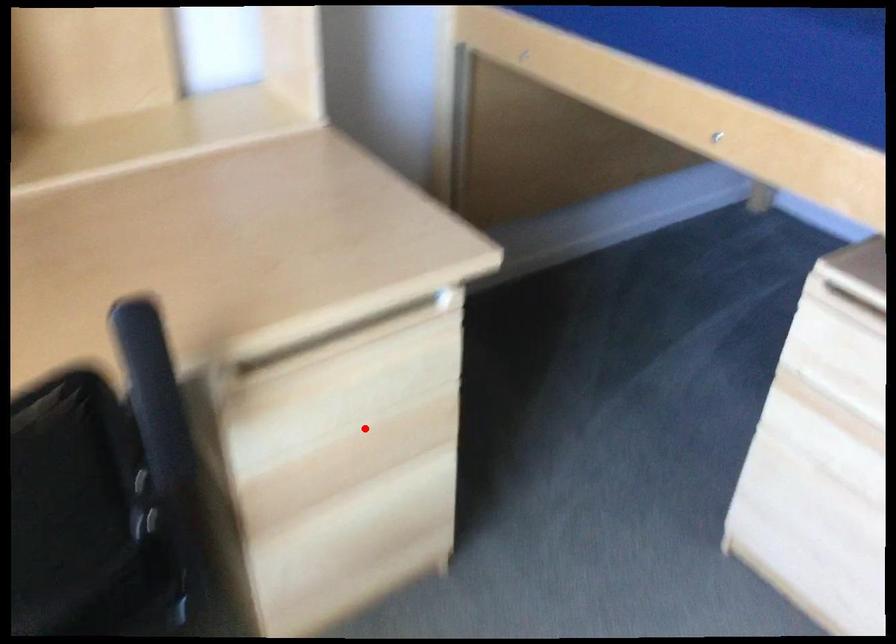
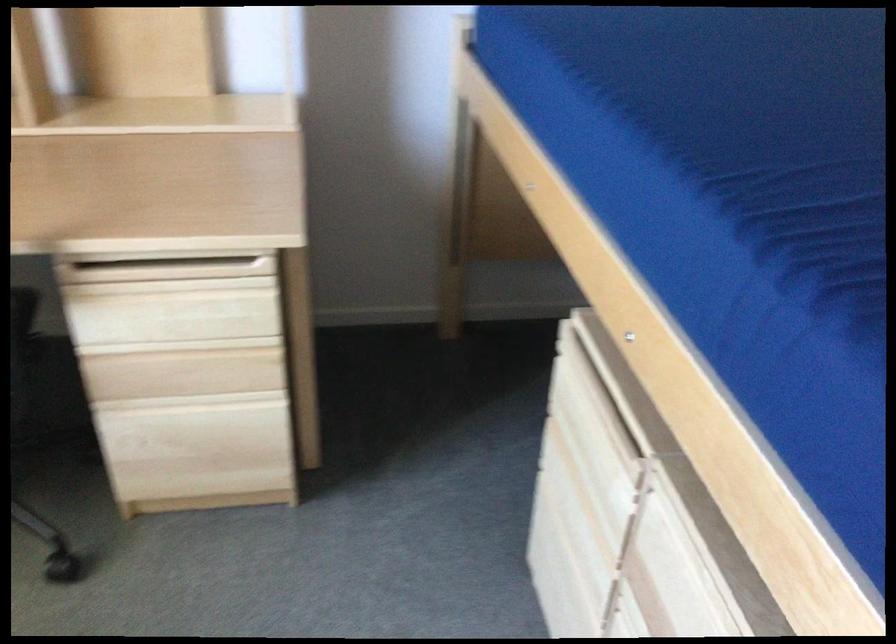
Locate, in the second image, the point that corresponds to the highlighted location in the first image.

(179, 346)